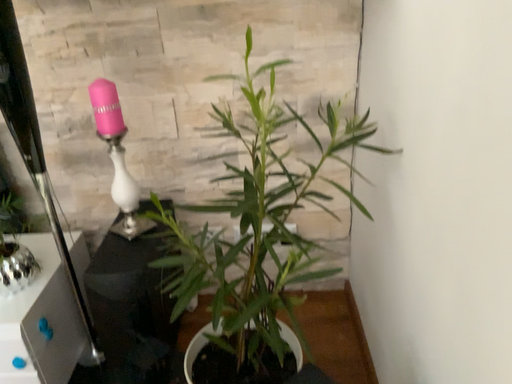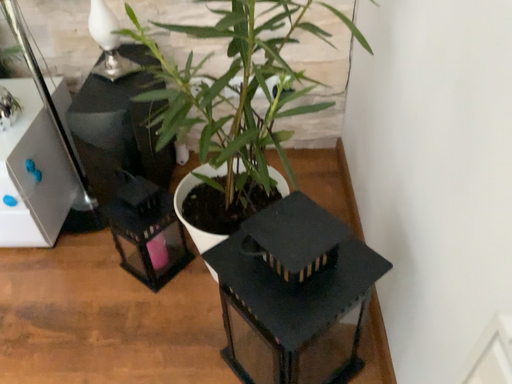
Question: Which way did the camera rotate in the video?

Choices:
 (A) rotated downward
 (B) rotated upward

Answer: (A)